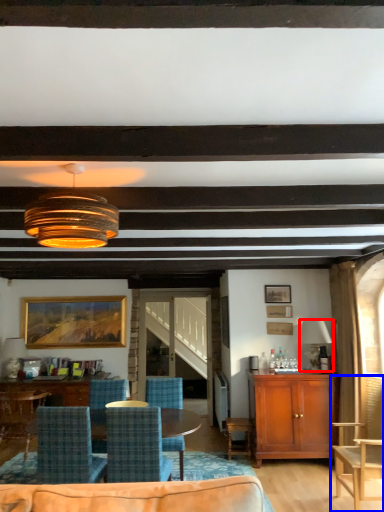
Question: Which point is closer to the camera, lamp (highlighted by a red box) or chair (highlighted by a blue box)?

Choices:
 (A) lamp
 (B) chair

Answer: (B)